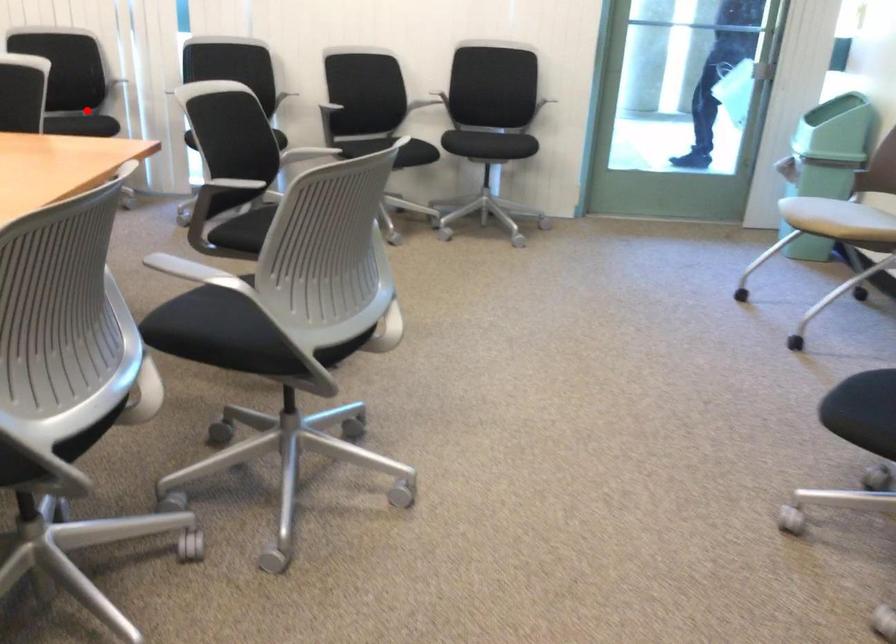
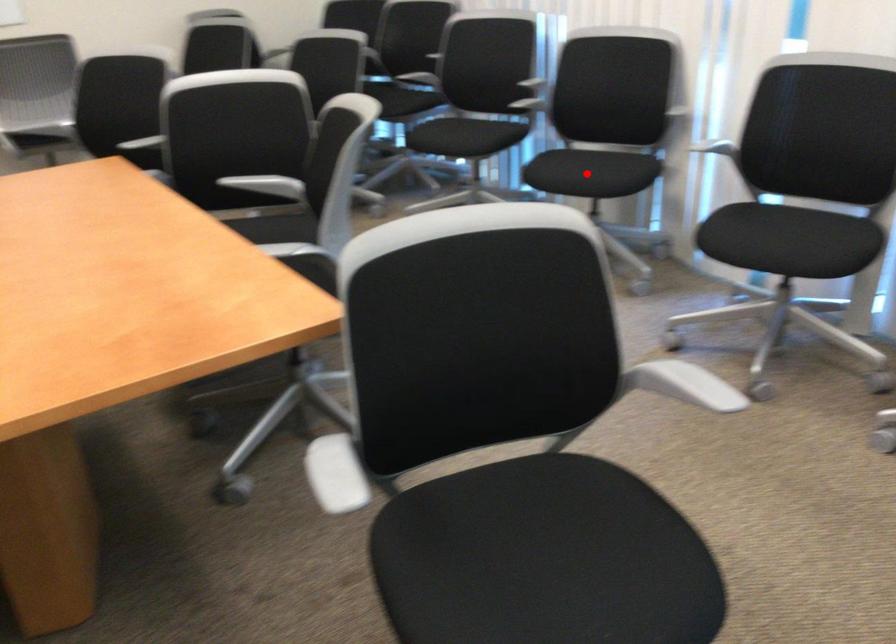
I am providing you with two images of the same scene from different viewpoints. A red point is marked on the first image and another point is marked on the second image. Is the red point in image1 aligned with the point shown in image2?

Yes